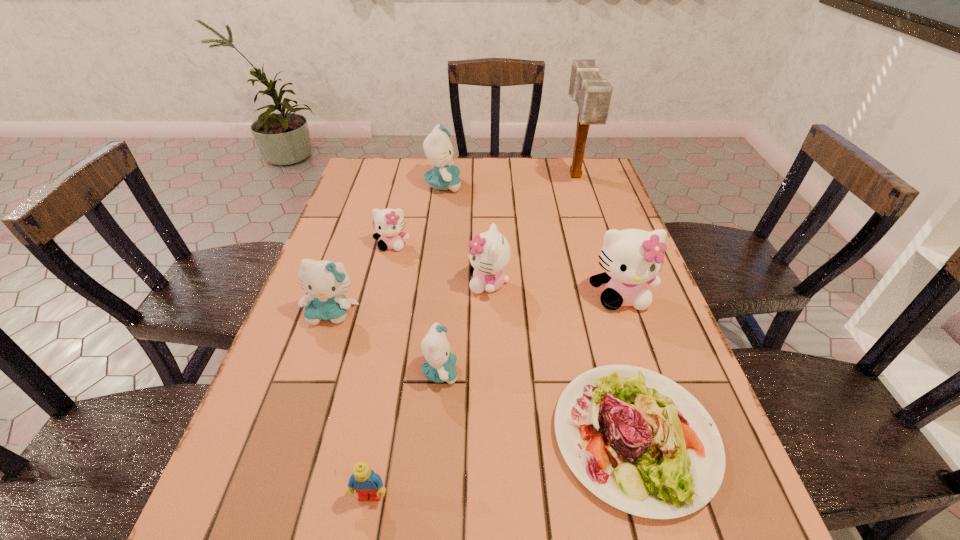
The image size is (960, 540). In order to click on vacant region located on the front-facing side of the rightmost kitten in this screenshot , I will do `click(636, 342)`.

The height and width of the screenshot is (540, 960). I want to click on vacant space located on the front-facing side of the sixth object from left to right, so click(428, 284).

I want to click on vacant space located on the front-facing side of the sixth object from left to right, so click(393, 284).

Locate an element on the screen. vacant space located on the front-facing side of the sixth object from left to right is located at coordinates (444, 284).

Where is `free region located on the face of the leftmost blue kitten`? This screenshot has width=960, height=540. free region located on the face of the leftmost blue kitten is located at coordinates (276, 476).

Image resolution: width=960 pixels, height=540 pixels. Identify the location of free space located on the face of the nearest blue kitten. (541, 372).

Where is `vacant region located 0.340m on the front-facing side of the leftmost white kitten`? The width and height of the screenshot is (960, 540). vacant region located 0.340m on the front-facing side of the leftmost white kitten is located at coordinates (366, 354).

You are a GUI agent. You are given a task and a screenshot of the screen. Output one action in this format:
    pyautogui.click(x=<x>, y=<y>)
    Task: Click on the free space located on the face of the eighth tallest object
    
    Given the screenshot: What is the action you would take?
    pyautogui.click(x=363, y=539)

Identify the location of vacant space located on the left of the green salad plate. (427, 436).

At what (x,y) coordinates should I click in order to perform the action: click on mallet that is at the far edge. Please return your answer as a coordinate pair (x, y). Looking at the image, I should click on (592, 94).